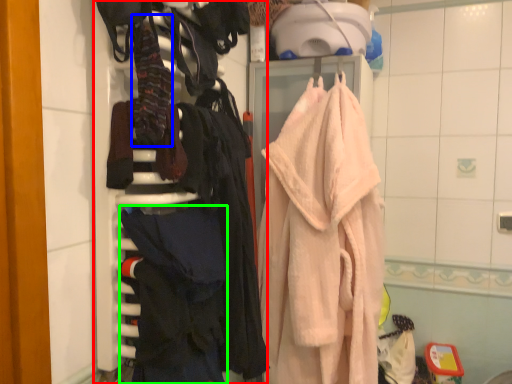
Question: Based on their relative distances, which object is nearer to closet (highlighted by a red box)? Choose from clothing (highlighted by a blue box) and clothing (highlighted by a green box).

Choices:
 (A) clothing
 (B) clothing

Answer: (B)